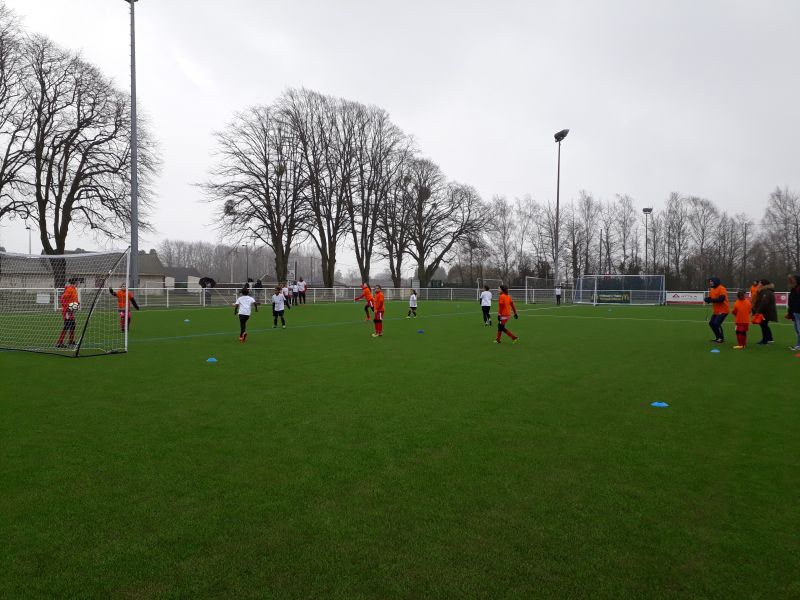
Locate an element on the screen. tall lights is located at coordinates point(133,150), point(558,134), point(649,211).